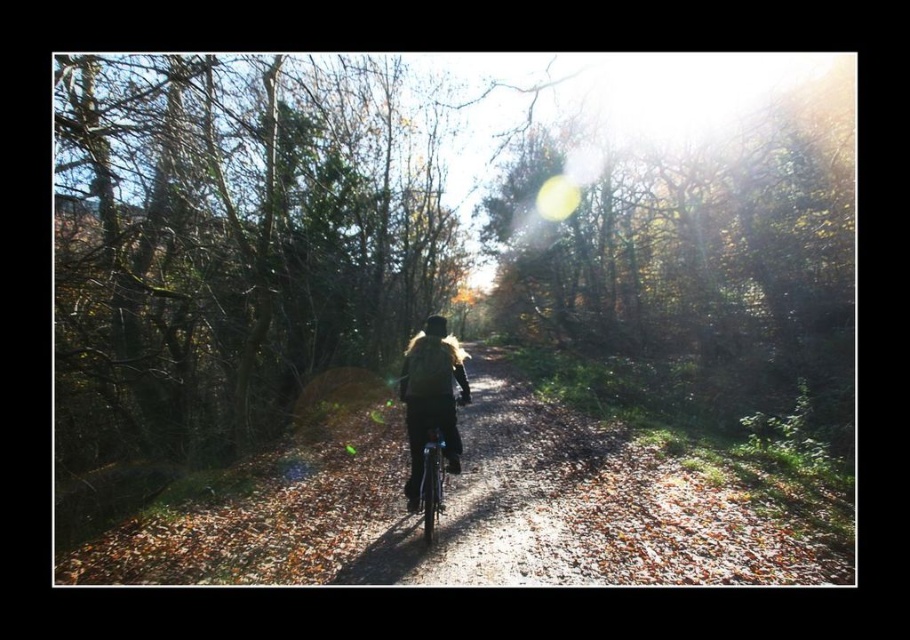
Does point (370, 547) lie in front of point (416, 346)?

That is True.

Who is positioned more to the right, matte black bicycle at center or fuzzy black jacket at center?

matte black bicycle at center

Which is behind, point (557, 452) or point (430, 428)?

Point (557, 452)

Locate an element on the screen. matte black bicycle at center is located at coordinates (493, 499).

Can you confirm if matte black bicycle at center is positioned above black matte helmet at center?

Actually, matte black bicycle at center is below black matte helmet at center.

Between matte black bicycle at center and black matte helmet at center, which one appears on the right side from the viewer's perspective?

matte black bicycle at center is more to the right.

Image resolution: width=910 pixels, height=640 pixels. What do you see at coordinates (493, 499) in the screenshot?
I see `matte black bicycle at center` at bounding box center [493, 499].

Where is `matte black bicycle at center`? The image size is (910, 640). matte black bicycle at center is located at coordinates (493, 499).

Which is more to the right, fuzzy black jacket at center or black matte helmet at center?

fuzzy black jacket at center is more to the right.

Between fuzzy black jacket at center and black matte helmet at center, which one has less height?

fuzzy black jacket at center is shorter.

This screenshot has height=640, width=910. What do you see at coordinates (431, 403) in the screenshot?
I see `fuzzy black jacket at center` at bounding box center [431, 403].

Find the location of `fuzzy black jacket at center`. fuzzy black jacket at center is located at coordinates (431, 403).